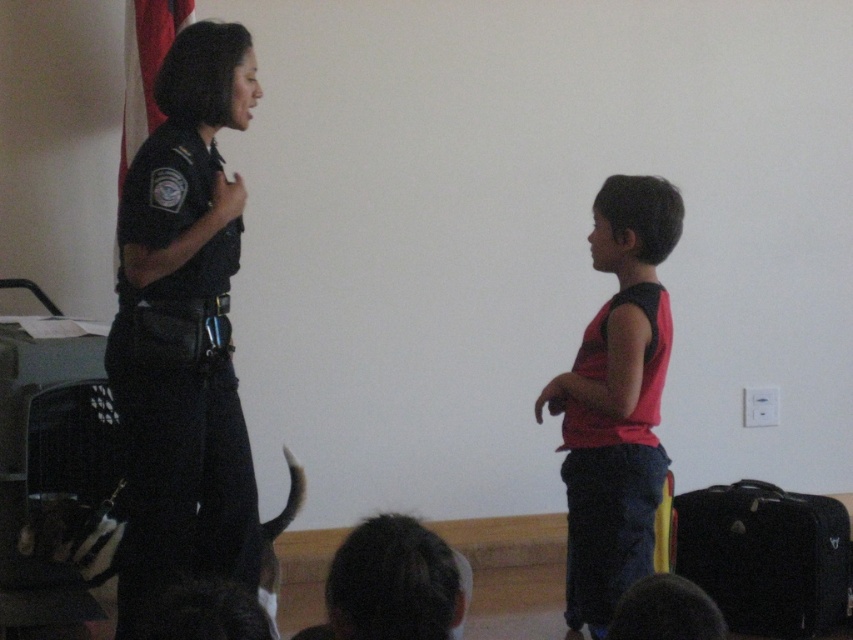
You are a security guard observing the scene. You notice the dark blue uniform at left and the black fabric suitcase at lower right. Which object is taller?

The dark blue uniform at left is taller than the black fabric suitcase at lower right according to the scene description.

Looking at this image, you are a fashion designer observing the scene. You need to decide which item, the red matte tank top at right or the black fabric suitcase at lower right, has a smaller width for designing a matching accessory. Which one should you choose?

The red matte tank top at right has a smaller width than the black fabric suitcase at lower right, so you should choose the red matte tank top at right to design a matching accessory.